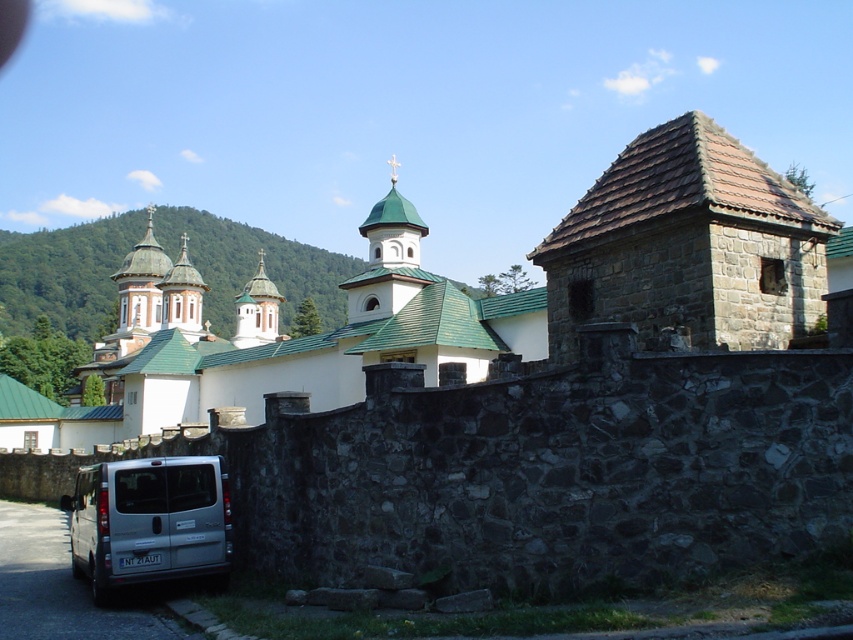
Can you confirm if silver metallic van at lower left is smaller than green metallic dome at center?

Correct, silver metallic van at lower left occupies less space than green metallic dome at center.

Who is higher up, silver metallic van at lower left or green metallic dome at center?

green metallic dome at center is higher up.

Locate an element on the screen. This screenshot has height=640, width=853. silver metallic van at lower left is located at coordinates (149, 522).

Locate an element on the screen. silver metallic van at lower left is located at coordinates (149, 522).

Does point (251, 328) lie behind point (192, 531)?

Yes, it is behind point (192, 531).

The height and width of the screenshot is (640, 853). I want to click on white stone church at center, so click(x=473, y=300).

Find the location of a particular element. Image resolution: width=853 pixels, height=640 pixels. white stone church at center is located at coordinates (473, 300).

Is point (241, 312) positioned after point (410, 252)?

Yes, point (241, 312) is behind point (410, 252).

What do you see at coordinates (473, 300) in the screenshot?
I see `white stone church at center` at bounding box center [473, 300].

At what (x,y) coordinates should I click in order to perform the action: click on white stone church at center. Please return your answer as a coordinate pair (x, y). This screenshot has height=640, width=853. Looking at the image, I should click on (473, 300).